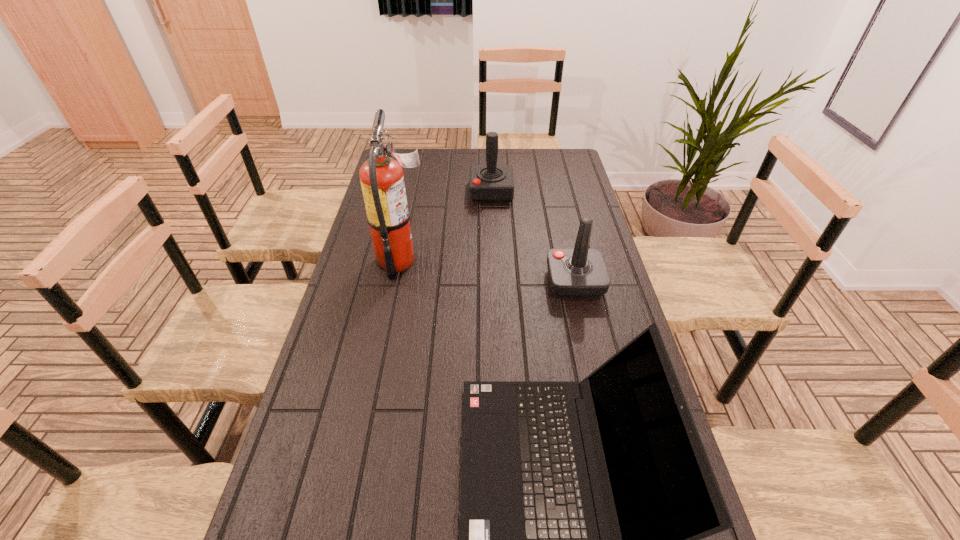
You are a GUI agent. You are given a task and a screenshot of the screen. Output one action in this format:
    pyautogui.click(x=<x>, y=<y>)
    Task: Click on the object located at the left edge
    
    Given the screenshot: What is the action you would take?
    pyautogui.click(x=382, y=181)

The image size is (960, 540). I want to click on object positioned at the right edge, so click(x=575, y=273).

Where is `vacant space at the far edge of the desktop`? This screenshot has width=960, height=540. vacant space at the far edge of the desktop is located at coordinates (426, 157).

Where is `vacant space at the left edge of the desktop`? vacant space at the left edge of the desktop is located at coordinates (409, 201).

The height and width of the screenshot is (540, 960). In the image, there is a desktop. Find the location of `vacant space at the far right corner`. vacant space at the far right corner is located at coordinates (555, 167).

Identify the location of empty space that is in between the tallest object and the right joystick. Image resolution: width=960 pixels, height=540 pixels. (489, 272).

You are a GUI agent. You are given a task and a screenshot of the screen. Output one action in this format:
    pyautogui.click(x=<x>, y=<y>)
    Task: Click on the vacant space that is in between the left joystick and the fire extinguisher
    The image size is (960, 540).
    Given the screenshot: What is the action you would take?
    pyautogui.click(x=446, y=226)

Where is `free space between the fire extinguisher and the right joystick`? free space between the fire extinguisher and the right joystick is located at coordinates (489, 272).

Where is `free spot between the farther joystick and the tallest object`? free spot between the farther joystick and the tallest object is located at coordinates (446, 226).

Where is `vacant region between the right joystick and the left joystick`? The width and height of the screenshot is (960, 540). vacant region between the right joystick and the left joystick is located at coordinates (533, 237).